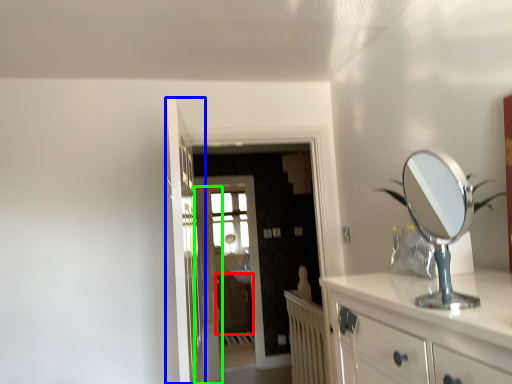
Question: Which is farther away from cabinetry (highlighted by a red box)? door (highlighted by a blue box) or door (highlighted by a green box)?

Choices:
 (A) door
 (B) door

Answer: (A)